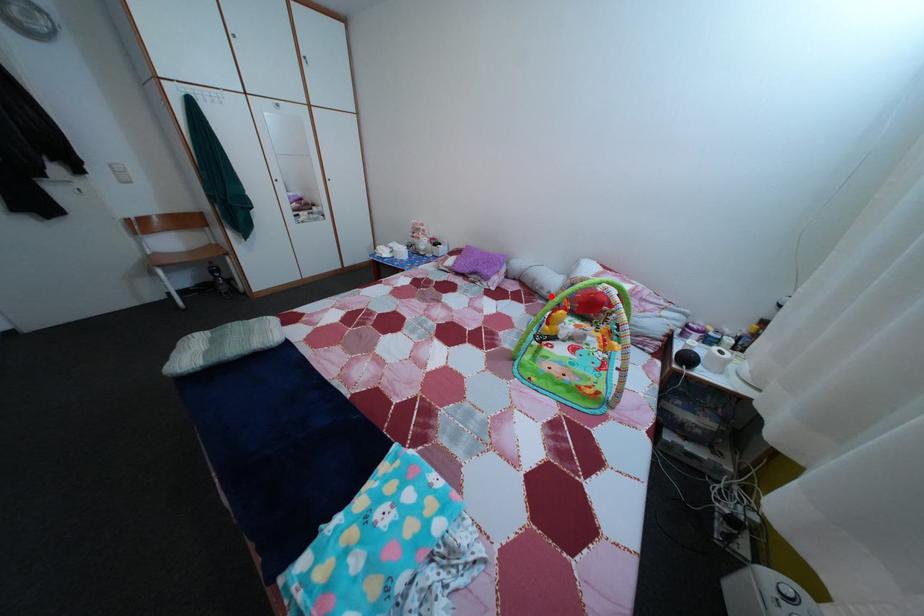
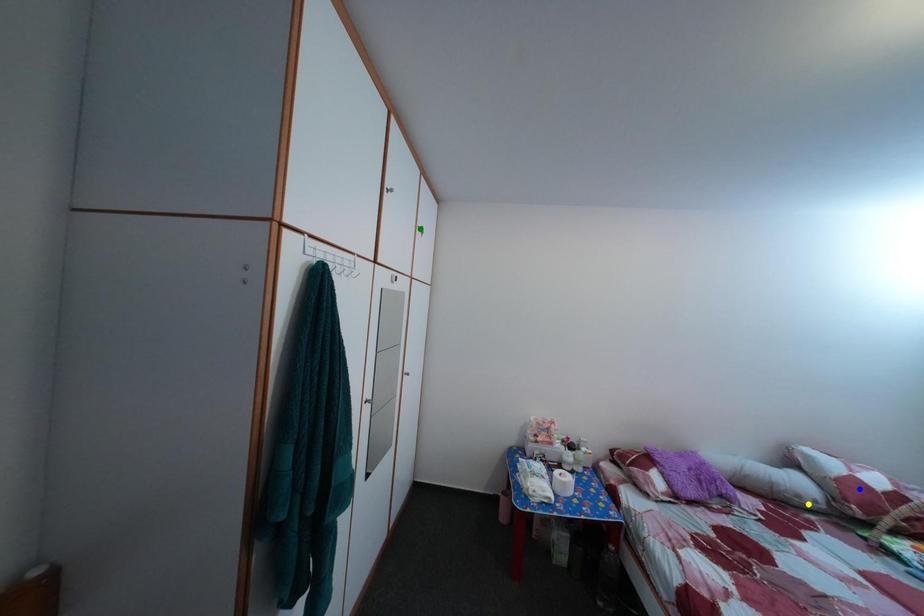
Question: I am providing you with two images of the same scene from different viewpoints. A red point is marked on the first image. You are given multiple points on the second image. Which point in image 2 represents the same 3d spot as the red point in image 1?

Choices:
 (A) yellow point
 (B) blue point
 (C) green point

Answer: (A)